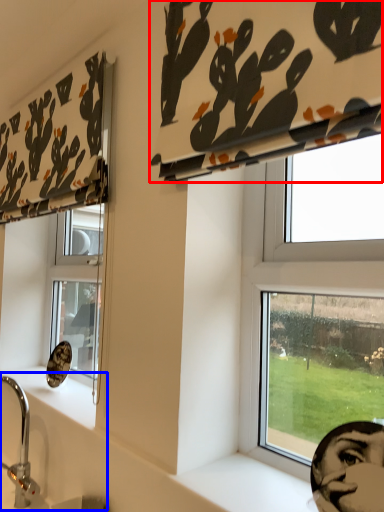
Question: Which of the following is the farthest to the observer, curtain (highlighted by a red box) or sink (highlighted by a blue box)?

Choices:
 (A) curtain
 (B) sink

Answer: (B)